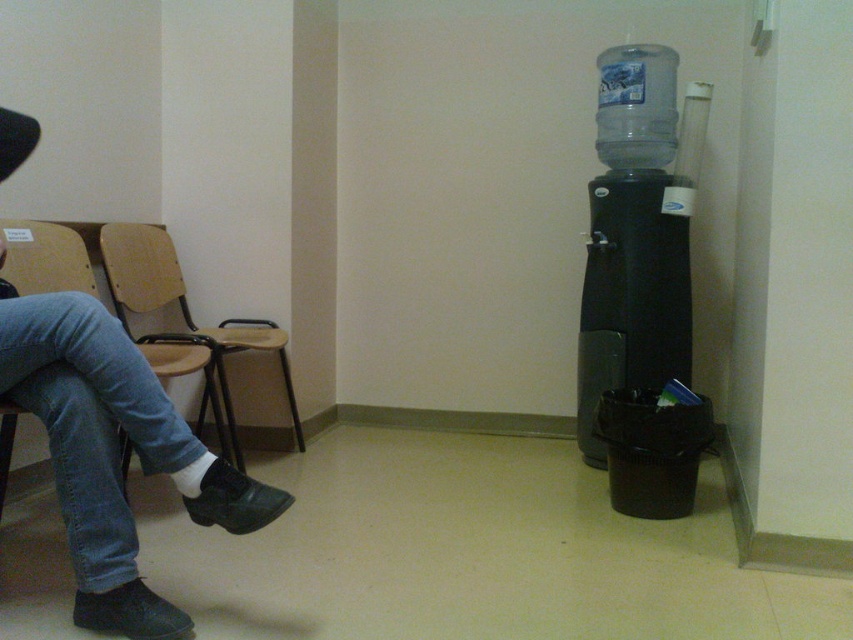
Between wooden seat at left and clear plastic bottle at right, which one has less height?

clear plastic bottle at right

Locate an element on the screen. This screenshot has height=640, width=853. wooden seat at left is located at coordinates (184, 320).

Can you confirm if black plastic water cooler at right is wider than clear plastic water cooler at right?

Correct, the width of black plastic water cooler at right exceeds that of clear plastic water cooler at right.

Which is above, black plastic water cooler at right or clear plastic water cooler at right?

clear plastic water cooler at right is higher up.

Who is more distant from viewer, (589, 198) or (602, 113)?

The point (589, 198) is more distant.

At what (x,y) coordinates should I click in order to perform the action: click on black plastic water cooler at right. Please return your answer as a coordinate pair (x, y). The width and height of the screenshot is (853, 640). Looking at the image, I should click on (631, 296).

From the picture: Who is higher up, clear plastic water cooler at right or wooden chair at left?

clear plastic water cooler at right is above.

Who is more forward, [605,128] or [194,502]?

Point [194,502] is more forward.

Find the location of a particular element. The width and height of the screenshot is (853, 640). clear plastic water cooler at right is located at coordinates (636, 106).